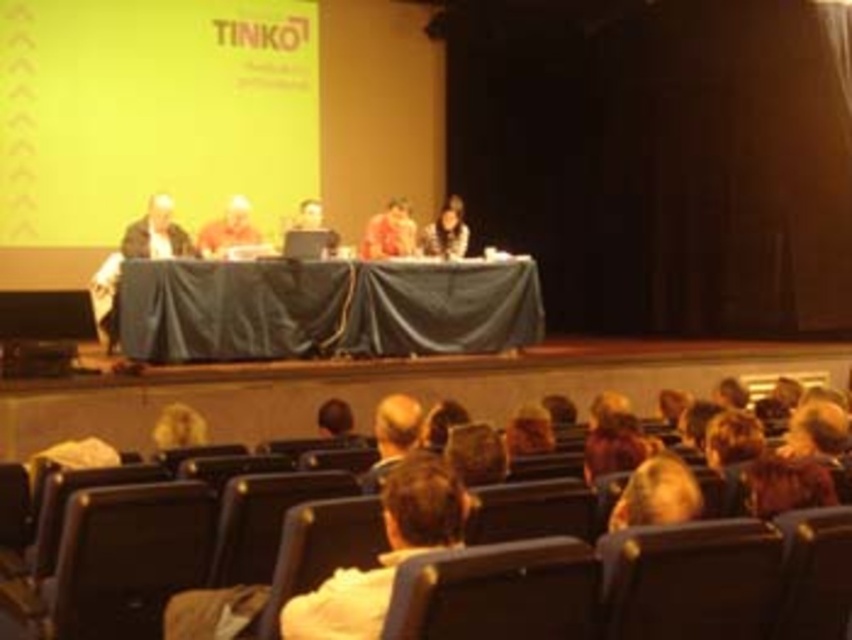
You are an event organizer who needs to set up a presentation. You have a projector that can project up to 3 meters wide. The yellow matte projection screen at upper center and the orange fabric at center are both available. Which one can accommodate your projector?

The yellow matte projection screen at upper center has a larger width than the orange fabric at center, so it can accommodate the projector since its width is up to 3 meters.

You are sitting in the auditorium and want to move to the stage. The black leather chair at lower right is blocking your path. Can you move around it to reach the stage?

The black leather chair at lower right is located at point (689, 580), so you can move around it to reach the stage.